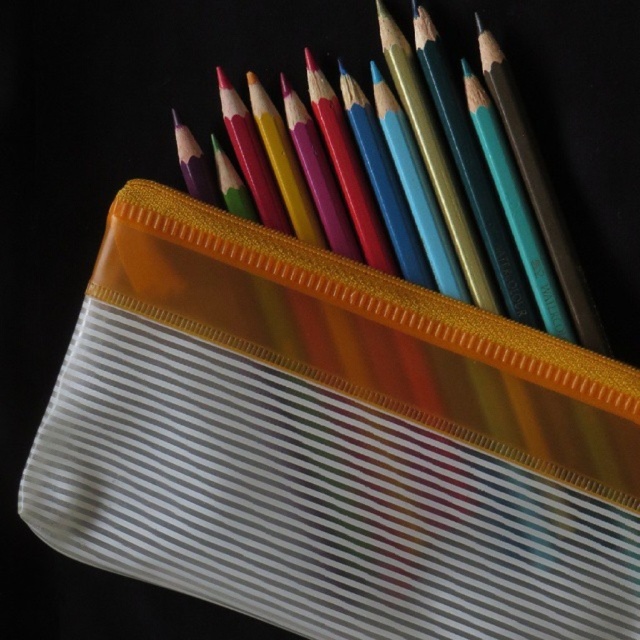
Question: Can you confirm if transparent plastic pencil case at upper center is positioned above matte plastic pencil at upper center?

Choices:
 (A) no
 (B) yes

Answer: (A)

Question: Which point is farther from the camera taking this photo?

Choices:
 (A) tap(532, 259)
 (B) tap(497, 600)

Answer: (A)

Question: Which point is closer to the camera?

Choices:
 (A) (524, 321)
 (B) (586, 620)

Answer: (B)

Question: Does transparent plastic pencil case at upper center have a lesser width compared to matte plastic pencil at upper center?

Choices:
 (A) yes
 (B) no

Answer: (B)

Question: Does transparent plastic pencil case at upper center appear on the right side of matte plastic pencil at upper center?

Choices:
 (A) no
 (B) yes

Answer: (A)

Question: Which point appears closest to the camera in this image?

Choices:
 (A) (172, 275)
 (B) (448, 74)

Answer: (B)